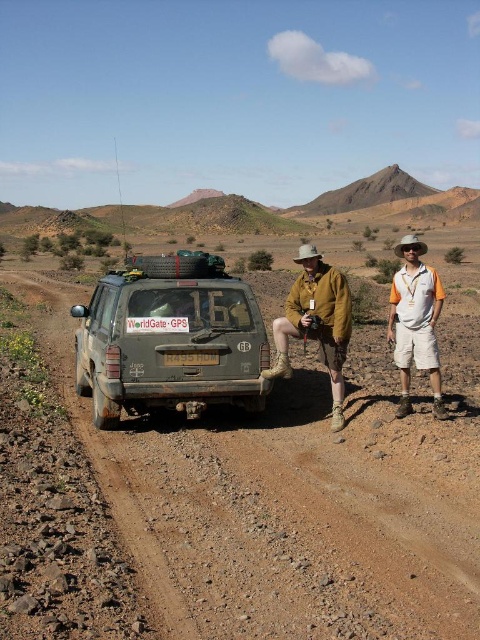
Measure the distance between point [357,628] and camera.

A distance of 11.35 feet exists between point [357,628] and camera.

Is point (475, 522) positioned after point (301, 310)?

No.

Image resolution: width=480 pixels, height=640 pixels. In order to click on brown gravel dirt track at center in this screenshot , I will do `click(287, 512)`.

Consider the image. Which is more to the right, brown suede jacket at center or white cotton shorts at right?

From the viewer's perspective, white cotton shorts at right appears more on the right side.

Is brown suede jacket at center smaller than white cotton shorts at right?

Yes, brown suede jacket at center is smaller than white cotton shorts at right.

Who is more forward, (312, 294) or (399, 408)?

Point (399, 408)

Where is `brown suede jacket at center`? The image size is (480, 640). brown suede jacket at center is located at coordinates (315, 323).

How far apart are camouflage fabric jacket at center and white plastic license plate at rear?

5.16 feet

Is camouflage fabric jacket at center in front of white plastic license plate at rear?

Yes, it is in front of white plastic license plate at rear.

The image size is (480, 640). What are the coordinates of `camouflage fabric jacket at center` in the screenshot? It's located at tap(316, 323).

I want to click on camouflage fabric jacket at center, so click(316, 323).